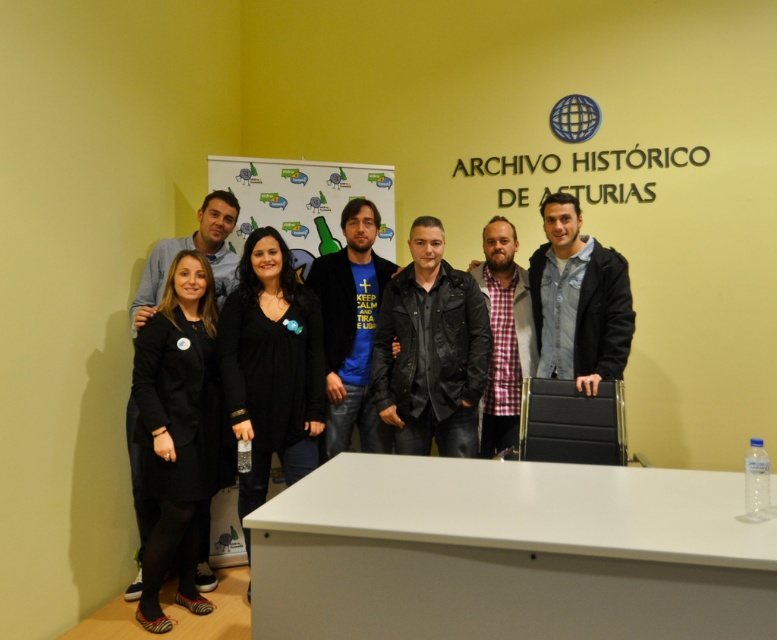
Question: Does white glossy table at lower center have a larger size compared to blue t-shirt at center?

Choices:
 (A) no
 (B) yes

Answer: (B)

Question: Which point appears farthest from the camera in this image?

Choices:
 (A) tap(366, 352)
 (B) tap(148, 387)
 (C) tap(570, 609)
 (D) tap(298, 196)

Answer: (D)

Question: Can you confirm if white glossy table at lower center is bigger than black matte dress at center?

Choices:
 (A) yes
 (B) no

Answer: (A)

Question: Does black matte dress at center lie behind matte plastic bulletin board at center?

Choices:
 (A) no
 (B) yes

Answer: (A)

Question: Which of these objects is positioned closest to the black matte dress at center?

Choices:
 (A) white glossy table at lower center
 (B) matte plastic bulletin board at center
 (C) black matte coat at left

Answer: (C)

Question: Estimate the real-world distances between objects in this image. Which object is closer to the blue t-shirt at center?

Choices:
 (A) matte plastic bulletin board at center
 (B) black matte dress at center

Answer: (B)